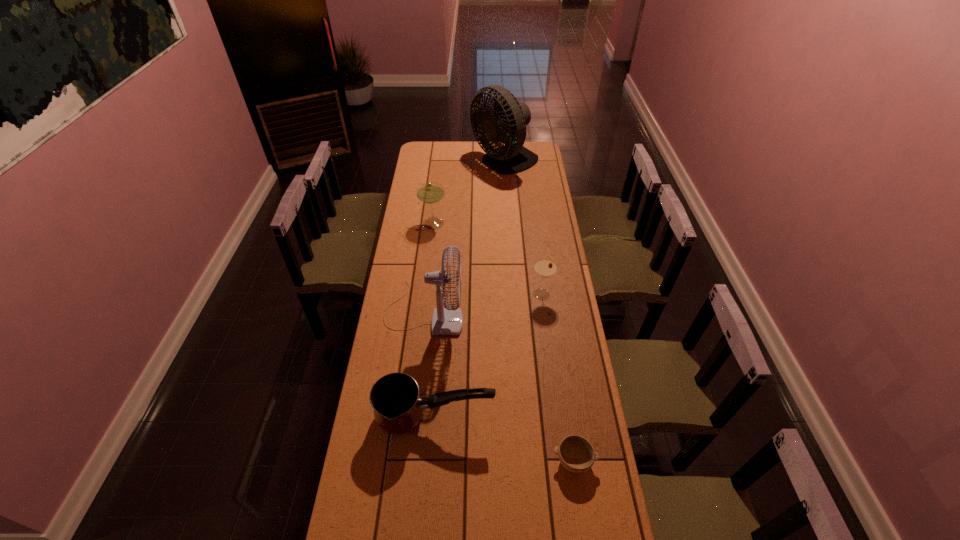
You are a GUI agent. You are given a task and a screenshot of the screen. Output one action in this format:
    pyautogui.click(x=<x>, y=<y>)
    Task: Click on the empty space that is in between the shortest object and the shorter martini
    
    Given the screenshot: What is the action you would take?
    pyautogui.click(x=558, y=377)

The image size is (960, 540). In order to click on vacant space that is in between the shorter fan and the farther martini in this screenshot , I will do `click(430, 267)`.

You are a GUI agent. You are given a task and a screenshot of the screen. Output one action in this format:
    pyautogui.click(x=<x>, y=<y>)
    Task: Click on the free space between the fifth farthest object and the bowl
    Image resolution: width=960 pixels, height=540 pixels.
    Given the screenshot: What is the action you would take?
    pyautogui.click(x=505, y=439)

Where is `free space between the right fan and the nearer fan`? This screenshot has height=540, width=960. free space between the right fan and the nearer fan is located at coordinates (465, 238).

At what (x,y) coordinates should I click in order to perform the action: click on free space between the left fan and the fifth farthest object. Please return your answer as a coordinate pair (x, y). The width and height of the screenshot is (960, 540). Looking at the image, I should click on (430, 364).

What are the coordinates of `vacant area between the left fan and the second nearest object` in the screenshot? It's located at (430, 364).

Locate an element on the screen. The height and width of the screenshot is (540, 960). free spot between the farther martini and the left fan is located at coordinates (430, 267).

I want to click on vacant area between the shorter fan and the left martini, so click(430, 267).

The height and width of the screenshot is (540, 960). Identify the location of free space between the right martini and the farther martini. (489, 259).

Where is `the second closest object to the shorter fan`? The height and width of the screenshot is (540, 960). the second closest object to the shorter fan is located at coordinates (544, 267).